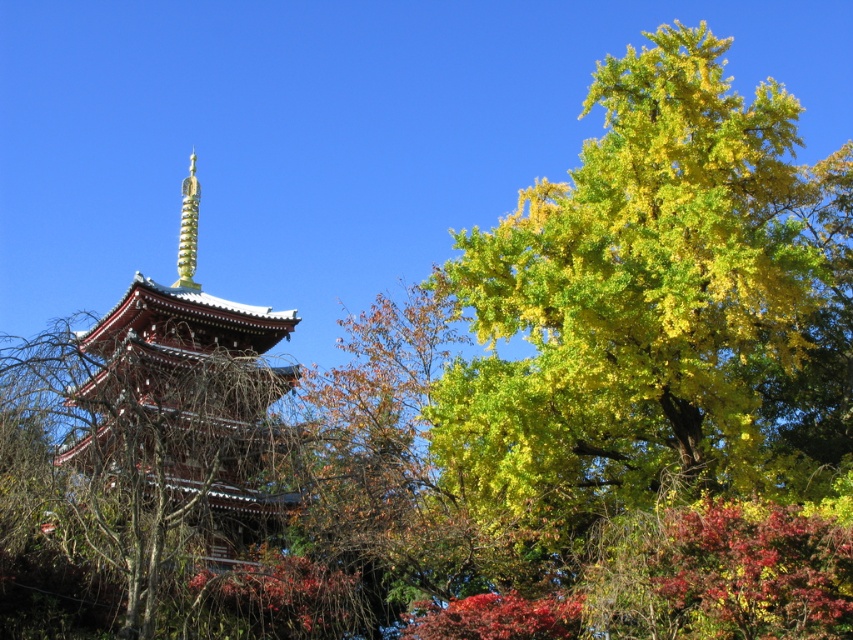
Question: Where is matte red pagoda at center located in relation to gold textured spire at upper center in the image?

Choices:
 (A) below
 (B) above

Answer: (A)

Question: Which point is farther from the camera taking this photo?

Choices:
 (A) (194, 424)
 (B) (178, 240)

Answer: (B)

Question: Which point is closer to the camera?

Choices:
 (A) gold textured spire at upper center
 (B) matte red pagoda at center

Answer: (B)

Question: Is matte red pagoda at center smaller than gold textured spire at upper center?

Choices:
 (A) yes
 (B) no

Answer: (B)

Question: Is matte red pagoda at center bigger than gold textured spire at upper center?

Choices:
 (A) no
 (B) yes

Answer: (B)